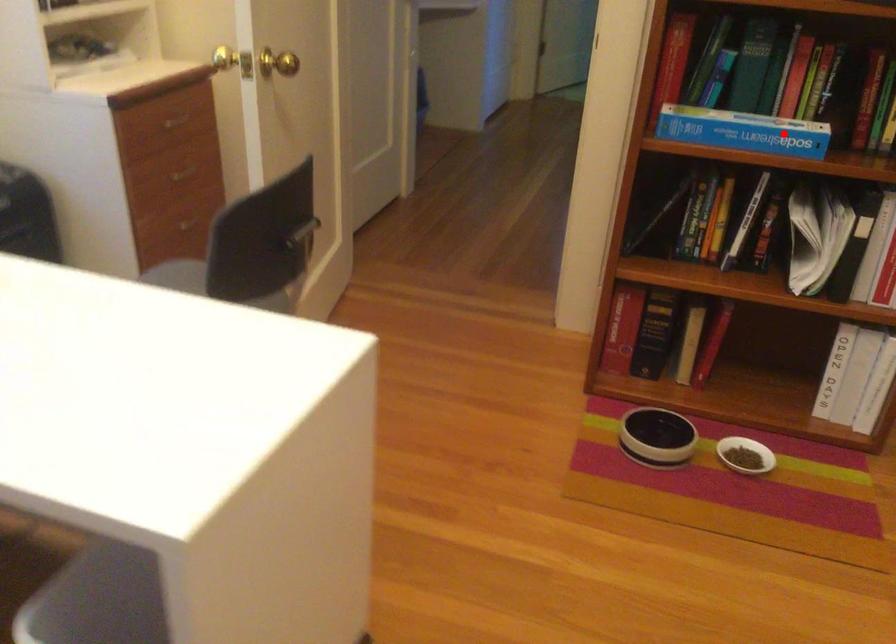
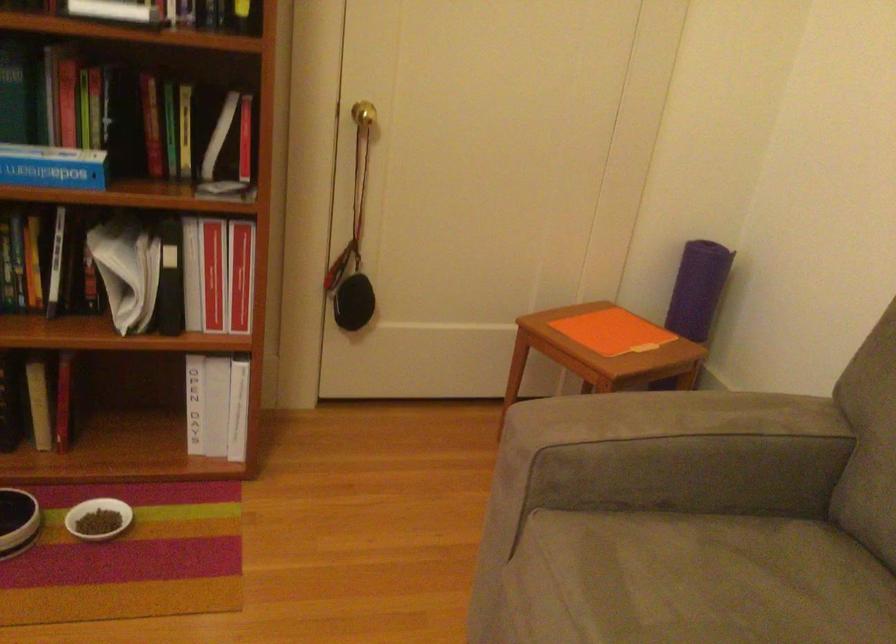
Where in the second image is the point corresponding to the highlighted location from the first image?

(53, 167)